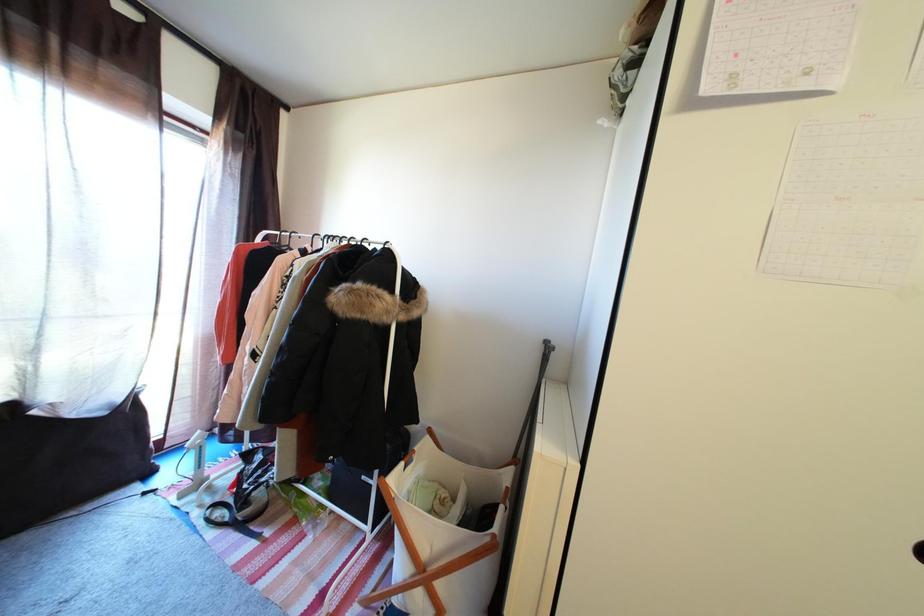
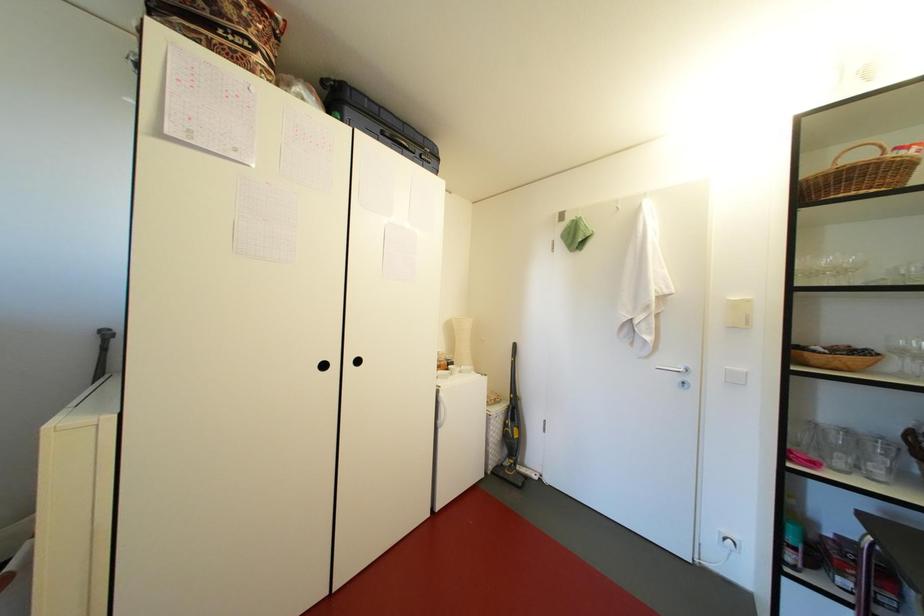
Question: The images are taken continuously from a first-person perspective. In which direction is your viewpoint rotating?

Choices:
 (A) Left
 (B) Right
 (C) Up
 (D) Down

Answer: (B)